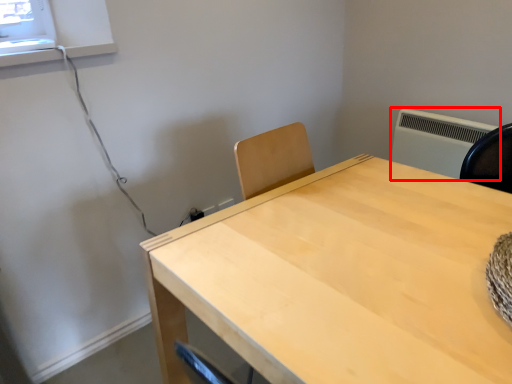
Question: From the image's perspective, what is the correct spatial positioning of air conditioning (annotated by the red box) in reference to table?

Choices:
 (A) above
 (B) below

Answer: (A)